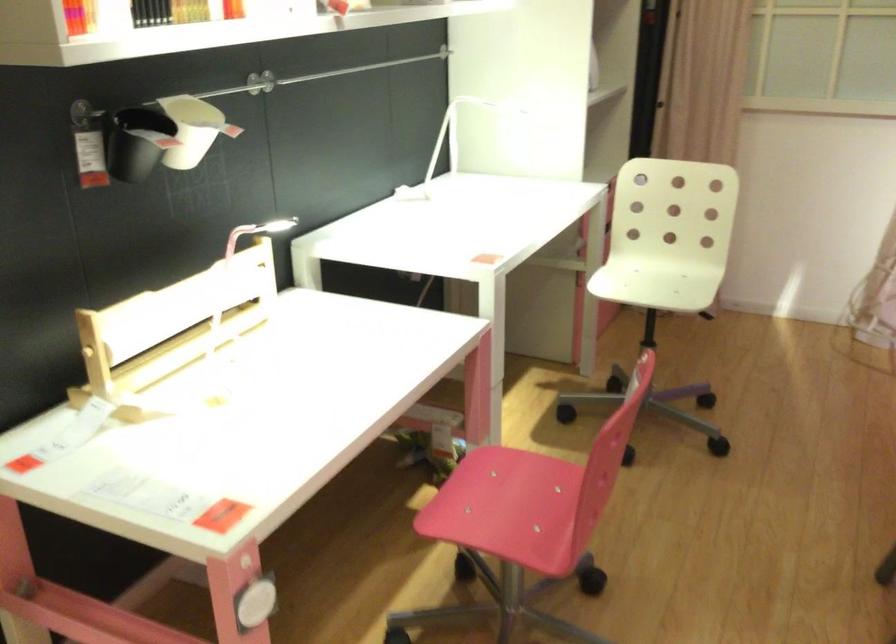
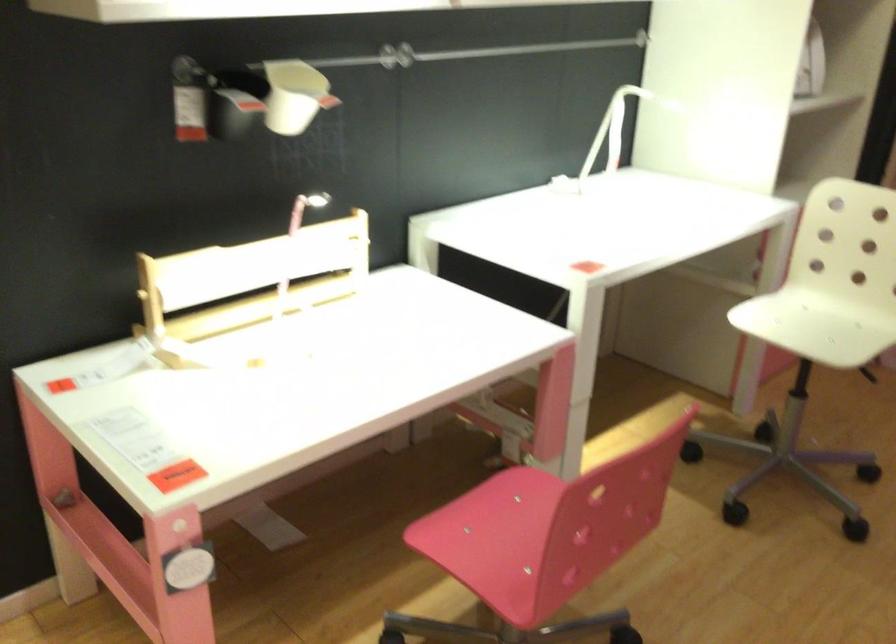
The point at (147, 154) is marked in the first image. Where is the corresponding point in the second image?

(227, 114)